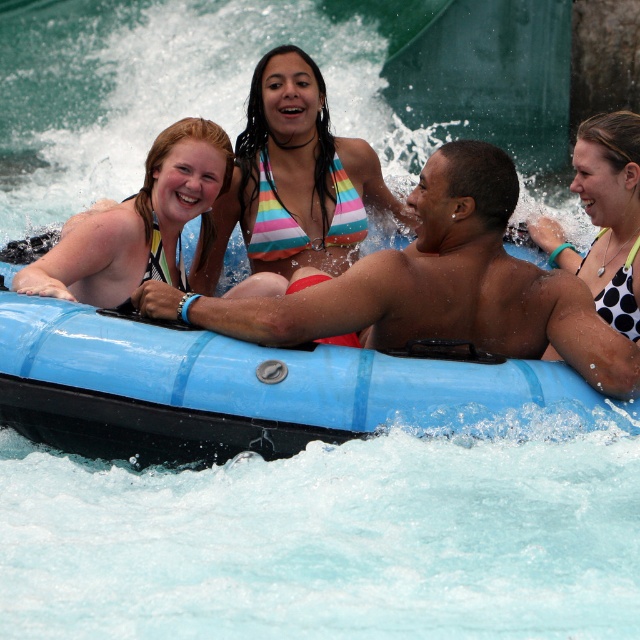
You are trying to decide whether to place a new float on the blue rubber raft at center. The float is the same size as the rainbow striped bikini top at center. Will it fit on the raft?

The blue rubber raft at center is smaller than the rainbow striped bikini top at center. Since the float is the same size as the bikini top, it will not fit on the raft.